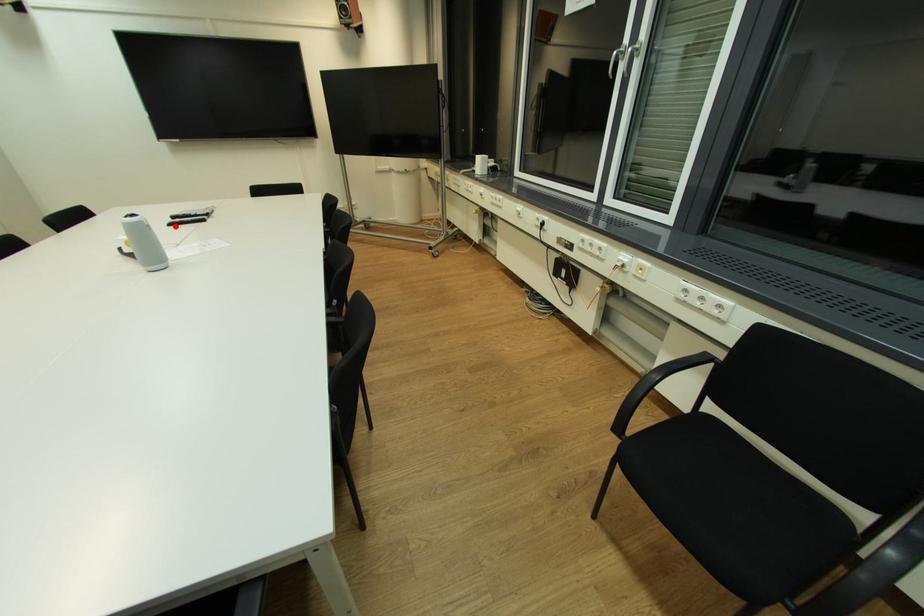
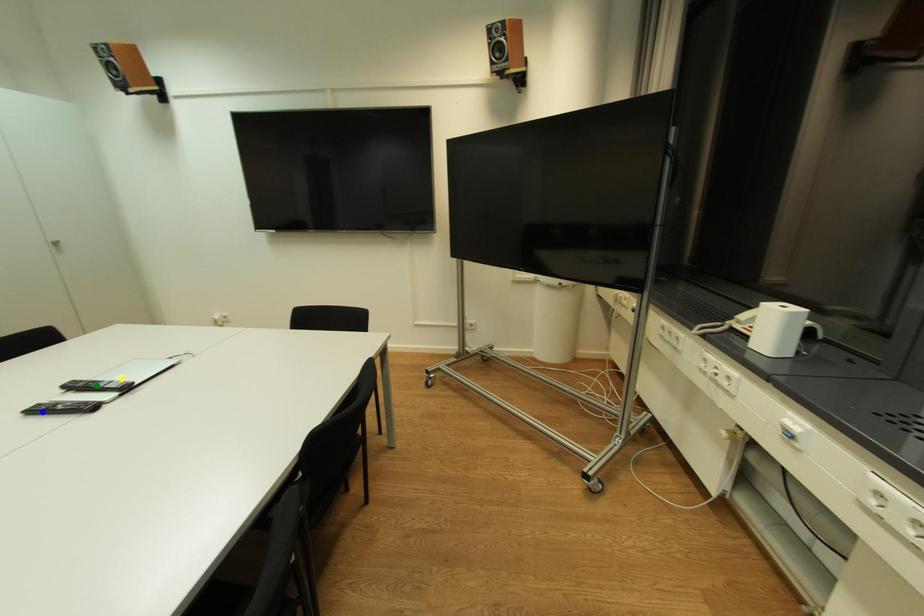
Question: I am providing you with two images of the same scene from different viewpoints. A red point is marked on the first image. You are given multiple points on the second image. Can you choose the point in image 2 that corresponds to the point in image 1?

Choices:
 (A) blue point
 (B) green point
 (C) yellow point

Answer: (A)